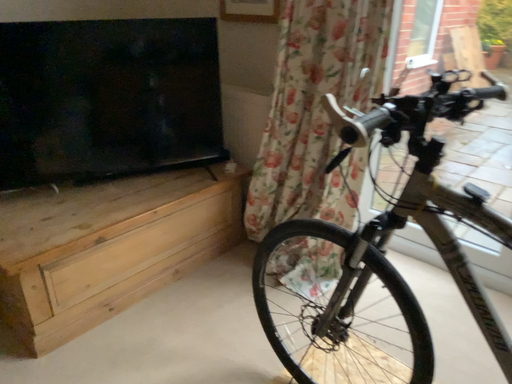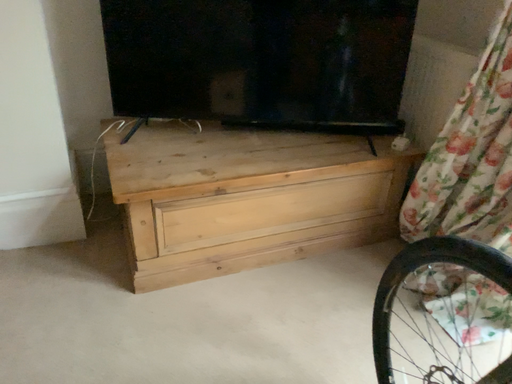
Question: Which way did the camera rotate in the video?

Choices:
 (A) rotated left
 (B) rotated right

Answer: (A)